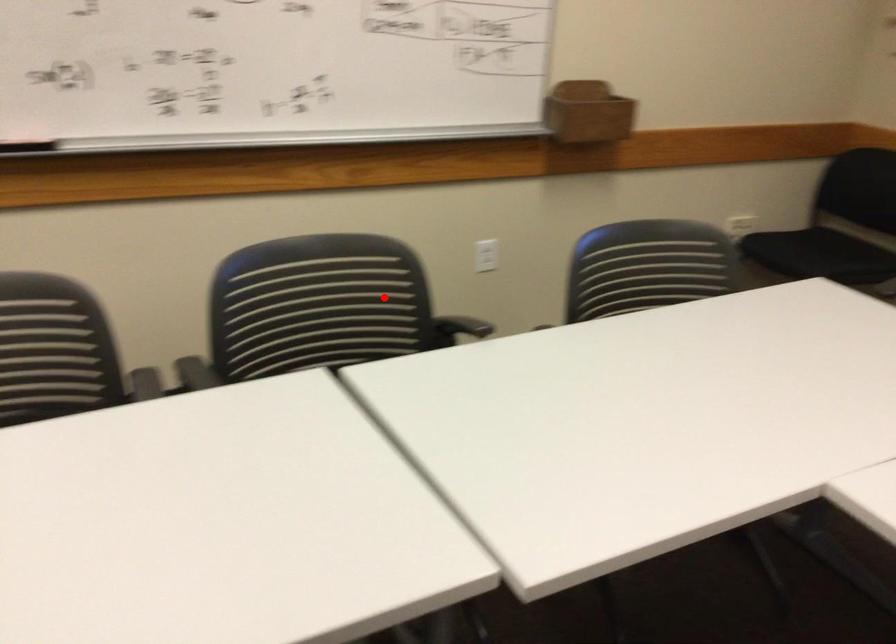
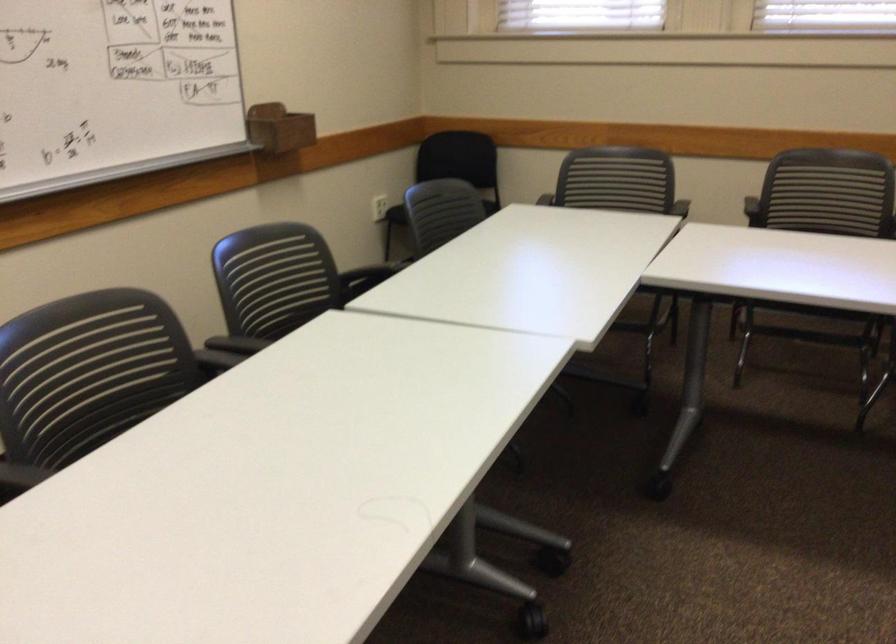
Question: I am providing you with two images of the same scene from different viewpoints. Image1 has a red point marked. In image2, the corresponding 3D location appears at what relative position? Reply with the corresponding letter.

Choices:
 (A) Closer
 (B) Farther

Answer: (B)